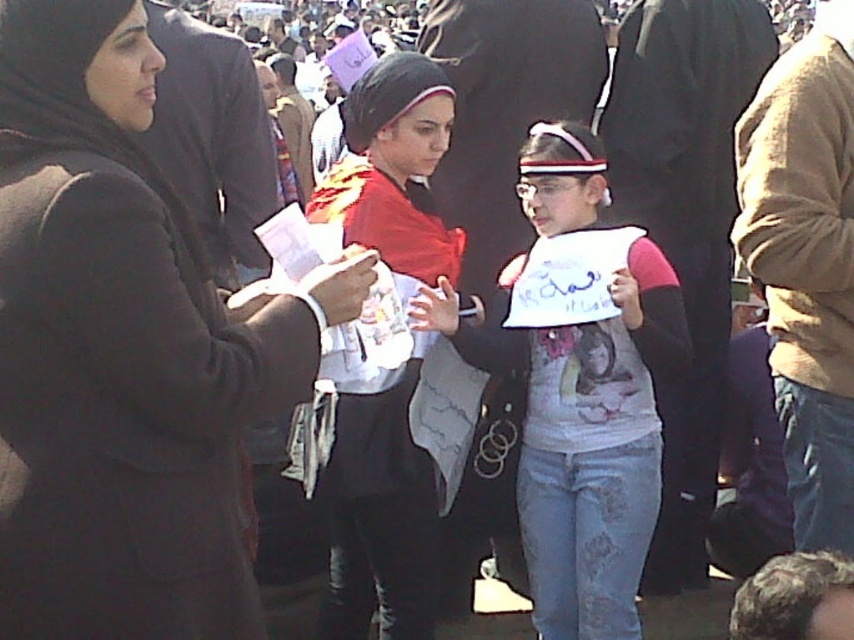
Question: Is the position of white paper sign at center more distant than that of matte black hijab at center?

Choices:
 (A) yes
 (B) no

Answer: (A)

Question: Which object is farther from the camera taking this photo?

Choices:
 (A) dark brown coat at left
 (B) white paper sign at center

Answer: (B)

Question: Which of these objects is positioned farthest from the dark brown coat at left?

Choices:
 (A) white paper sign at center
 (B) matte black hijab at center

Answer: (A)

Question: Considering the real-world distances, which object is closest to the dark brown coat at left?

Choices:
 (A) matte black hijab at center
 (B) white paper sign at center

Answer: (A)

Question: Can you confirm if dark brown coat at left is smaller than white paper sign at center?

Choices:
 (A) no
 (B) yes

Answer: (B)

Question: Does white paper sign at center appear on the left side of matte black hijab at center?

Choices:
 (A) yes
 (B) no

Answer: (B)